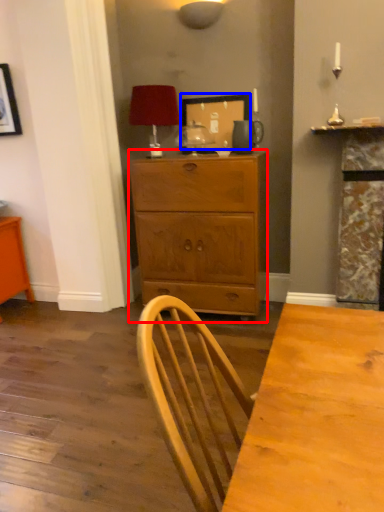
Question: Which object appears closest to the camera in this image, chest of drawers (highlighted by a red box) or picture frame (highlighted by a blue box)?

Choices:
 (A) chest of drawers
 (B) picture frame

Answer: (A)